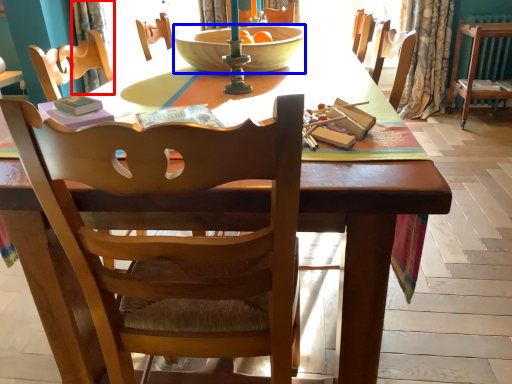
Question: Among these objects, which one is farthest to the camera, curtain (highlighted by a red box) or bowl (highlighted by a blue box)?

Choices:
 (A) curtain
 (B) bowl

Answer: (A)